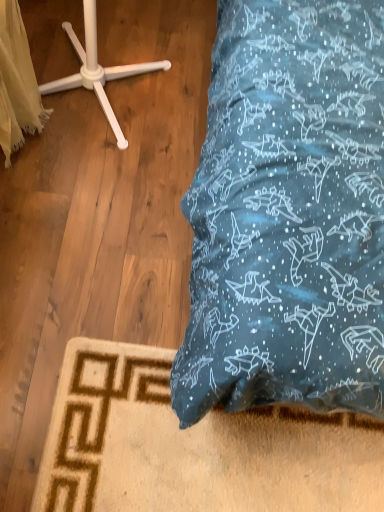
Locate an element on the screen. This screenshot has width=384, height=512. empty space that is in between white plastic coat stand at upper left and white fabric at left is located at coordinates (71, 135).